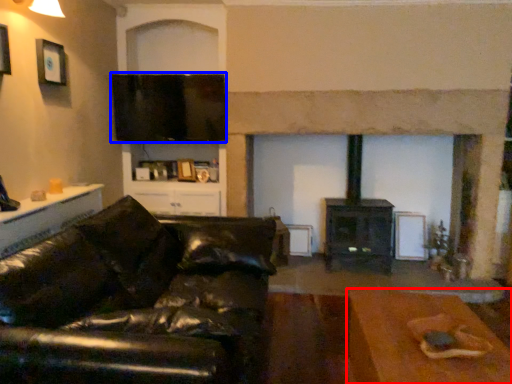
Question: Which object appears farthest to the camera in this image, table (highlighted by a red box) or window screen (highlighted by a blue box)?

Choices:
 (A) table
 (B) window screen

Answer: (B)